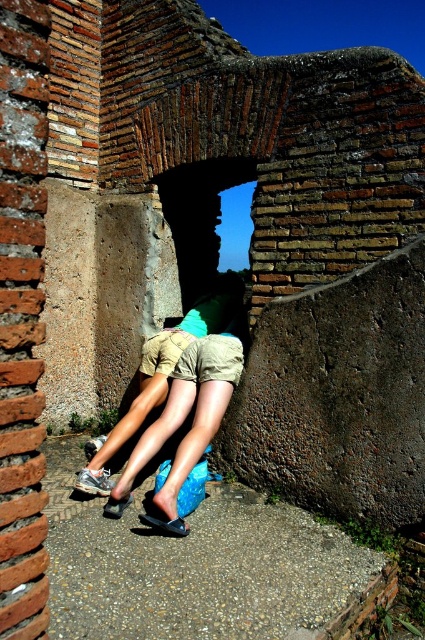
Question: Estimate the real-world distances between objects in this image. Which object is farther from the black leather sandal at lower center?

Choices:
 (A) khaki shorts at center
 (B) black matte sandal at lower center

Answer: (A)

Question: In this image, where is khaki shorts at center located relative to black leather sandal at lower center?

Choices:
 (A) above
 (B) below

Answer: (A)

Question: Which of these objects is positioned closest to the black matte sandal at lower center?

Choices:
 (A) khaki shorts at center
 (B) black leather sandal at lower center

Answer: (B)

Question: Does khaki shorts at center lie in front of black matte sandal at lower center?

Choices:
 (A) no
 (B) yes

Answer: (A)

Question: Which point appears closest to the camera in this image?

Choices:
 (A) (115, 516)
 (B) (127, 428)

Answer: (A)

Question: Considering the relative positions of black matte sandal at lower center and black leather sandal at lower center in the image provided, where is black matte sandal at lower center located with respect to black leather sandal at lower center?

Choices:
 (A) right
 (B) left

Answer: (A)